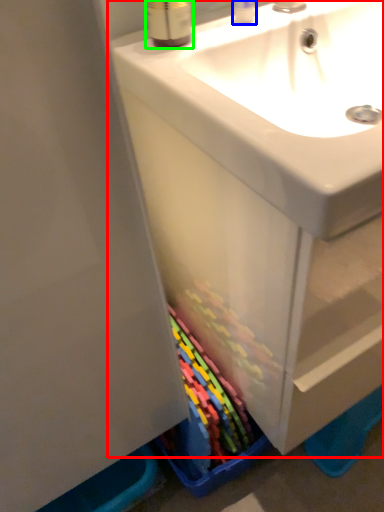
Question: Which object is positioned closest to bathroom cabinet (highlighted by a red box)? Select from toiletry (highlighted by a blue box) and mouthwash (highlighted by a green box).

Choices:
 (A) toiletry
 (B) mouthwash

Answer: (B)